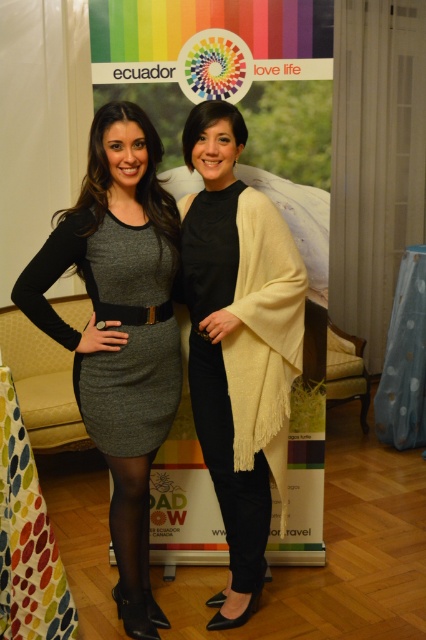
Question: Can you confirm if matte gray dress at center is thinner than gray wool dress at center?

Choices:
 (A) no
 (B) yes

Answer: (A)

Question: Based on their relative distances, which object is farther from the matte gray dress at center?

Choices:
 (A) creamy woolen shawl at center
 (B) gray wool dress at center

Answer: (A)

Question: Estimate the real-world distances between objects in this image. Which object is closer to the gray wool dress at center?

Choices:
 (A) creamy woolen shawl at center
 (B) black denim jeans at center
 (C) matte gray dress at center

Answer: (C)

Question: Does creamy woolen shawl at center have a smaller size compared to black denim jeans at center?

Choices:
 (A) no
 (B) yes

Answer: (A)

Question: From the image, what is the correct spatial relationship of creamy woolen shawl at center in relation to black denim jeans at center?

Choices:
 (A) below
 (B) above

Answer: (B)

Question: Which point is farther from the camera taking this photo?

Choices:
 (A) (149, 401)
 (B) (233, 520)

Answer: (B)